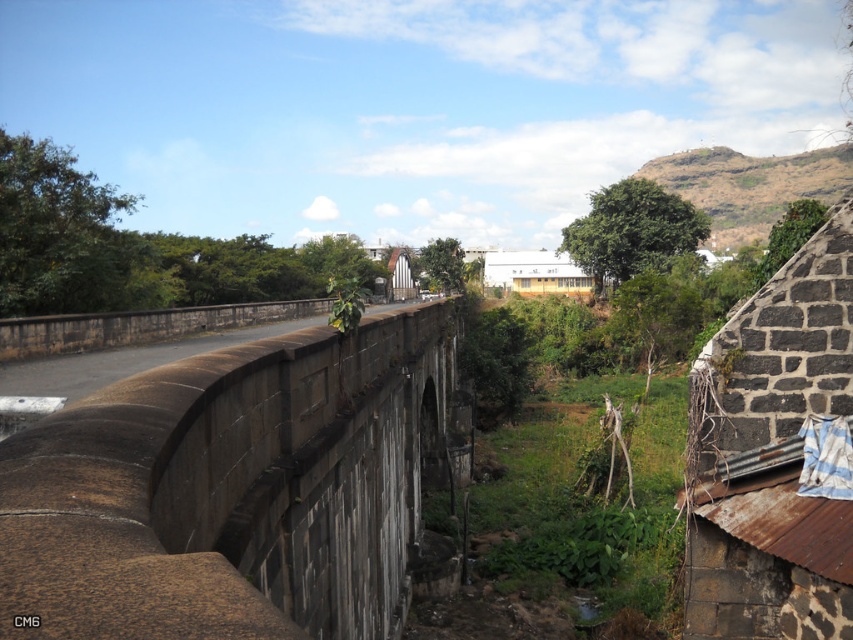
Question: Which point is farther to the camera?

Choices:
 (A) brown stone bridge at center
 (B) dark gray stone wall at upper right

Answer: (B)

Question: Which of the following is the closest to the observer?

Choices:
 (A) (112, 506)
 (B) (712, 346)

Answer: (A)

Question: Does brown stone bridge at center have a lesser width compared to dark gray stone wall at upper right?

Choices:
 (A) no
 (B) yes

Answer: (A)

Question: Is brown stone bridge at center thinner than dark gray stone wall at upper right?

Choices:
 (A) no
 (B) yes

Answer: (A)

Question: Can you confirm if brown stone bridge at center is positioned to the right of dark gray stone wall at upper right?

Choices:
 (A) yes
 (B) no

Answer: (B)